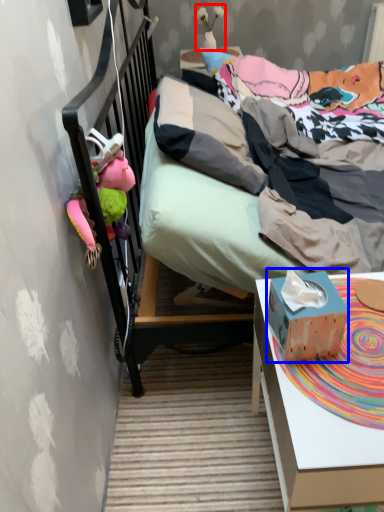
Question: Which object is further to the camera taking this photo, toy (highlighted by a red box) or box (highlighted by a blue box)?

Choices:
 (A) toy
 (B) box

Answer: (A)